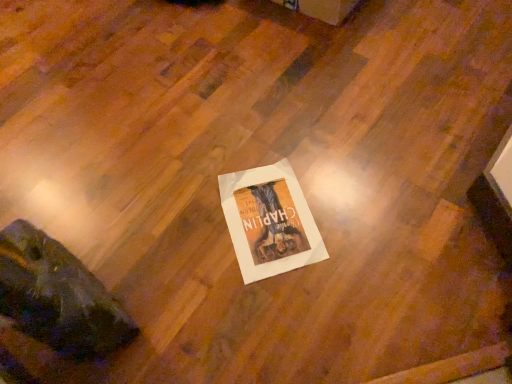
Where is `vacant space behind white paper book at center`? This screenshot has height=384, width=512. vacant space behind white paper book at center is located at coordinates (286, 138).